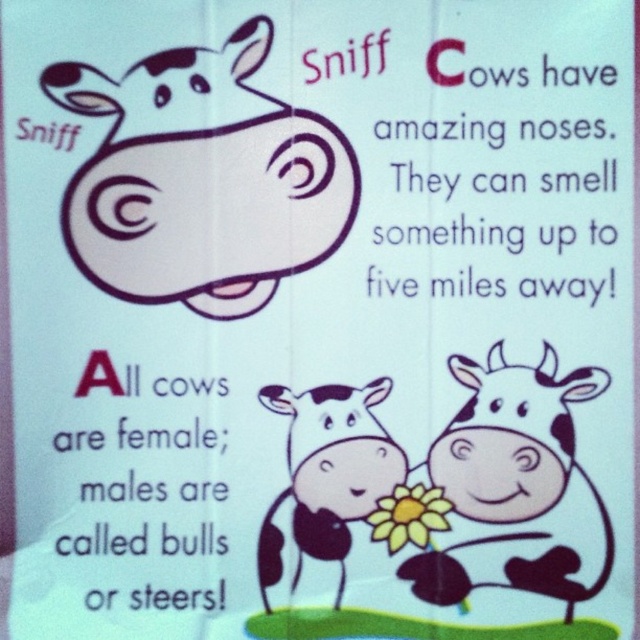
Does point (227, 260) lie in front of point (429, 449)?

That is False.

Is white matte cow at upper left to the left of white spotted cow at lower right from the viewer's perspective?

Correct, you'll find white matte cow at upper left to the left of white spotted cow at lower right.

Who is more forward, (150, 243) or (600, 588)?

Point (600, 588) is more forward.

Image resolution: width=640 pixels, height=640 pixels. I want to click on white matte cow at upper left, so click(x=202, y=179).

Can you confirm if white matte cow at upper left is bigger than black paper text at lower center?

Indeed, white matte cow at upper left has a larger size compared to black paper text at lower center.

Where is `white matte cow at upper left`? white matte cow at upper left is located at coordinates (202, 179).

Is black and white spotted cow at center to the right of black paper text at lower center from the viewer's perspective?

Yes, black and white spotted cow at center is to the right of black paper text at lower center.

Does black and white spotted cow at center come behind black paper text at lower center?

Yes, black and white spotted cow at center is further from the viewer.

This screenshot has width=640, height=640. What do you see at coordinates (328, 474) in the screenshot?
I see `black and white spotted cow at center` at bounding box center [328, 474].

Locate an element on the screen. black and white spotted cow at center is located at coordinates [328, 474].